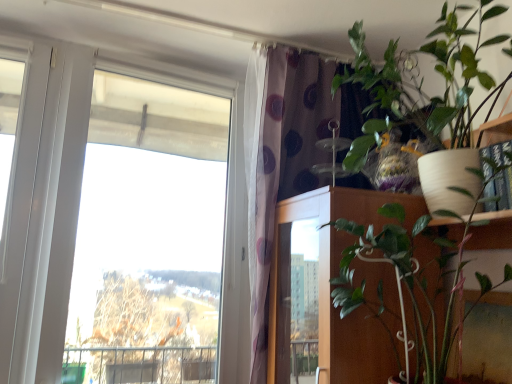
Question: Can you confirm if purple dotted curtain at upper center is wider than wooden door at center?

Choices:
 (A) no
 (B) yes

Answer: (A)

Question: Considering the relative sizes of purple dotted curtain at upper center and wooden door at center in the image provided, is purple dotted curtain at upper center bigger than wooden door at center?

Choices:
 (A) yes
 (B) no

Answer: (A)

Question: Is purple dotted curtain at upper center touching wooden door at center?

Choices:
 (A) yes
 (B) no

Answer: (B)

Question: From a real-world perspective, is purple dotted curtain at upper center positioned over wooden door at center based on gravity?

Choices:
 (A) yes
 (B) no

Answer: (A)

Question: Is purple dotted curtain at upper center taller than wooden door at center?

Choices:
 (A) yes
 (B) no

Answer: (A)

Question: From the image's perspective, is transparent glass window at left above or below white matte pot at upper right?

Choices:
 (A) below
 (B) above

Answer: (B)

Question: In terms of width, does transparent glass window at left look wider or thinner when compared to white matte pot at upper right?

Choices:
 (A) wide
 (B) thin

Answer: (B)

Question: Looking at the image, does transparent glass window at left seem bigger or smaller compared to white matte pot at upper right?

Choices:
 (A) small
 (B) big

Answer: (A)

Question: Considering their positions, is transparent glass window at left located in front of or behind white matte pot at upper right?

Choices:
 (A) front
 (B) behind

Answer: (B)

Question: Would you say white matte pot at upper right is to the left or to the right of wooden door at center in the picture?

Choices:
 (A) left
 (B) right

Answer: (B)

Question: Is white matte pot at upper right wider or thinner than wooden door at center?

Choices:
 (A) thin
 (B) wide

Answer: (B)

Question: Is white matte pot at upper right bigger or smaller than wooden door at center?

Choices:
 (A) small
 (B) big

Answer: (A)

Question: From a real-world perspective, is white matte pot at upper right above or below wooden door at center?

Choices:
 (A) below
 (B) above

Answer: (B)

Question: Relative to transparent glass window at left, is purple dotted curtain at upper center in front or behind?

Choices:
 (A) behind
 (B) front

Answer: (B)

Question: Based on their sizes in the image, would you say purple dotted curtain at upper center is bigger or smaller than transparent glass window at left?

Choices:
 (A) big
 (B) small

Answer: (A)